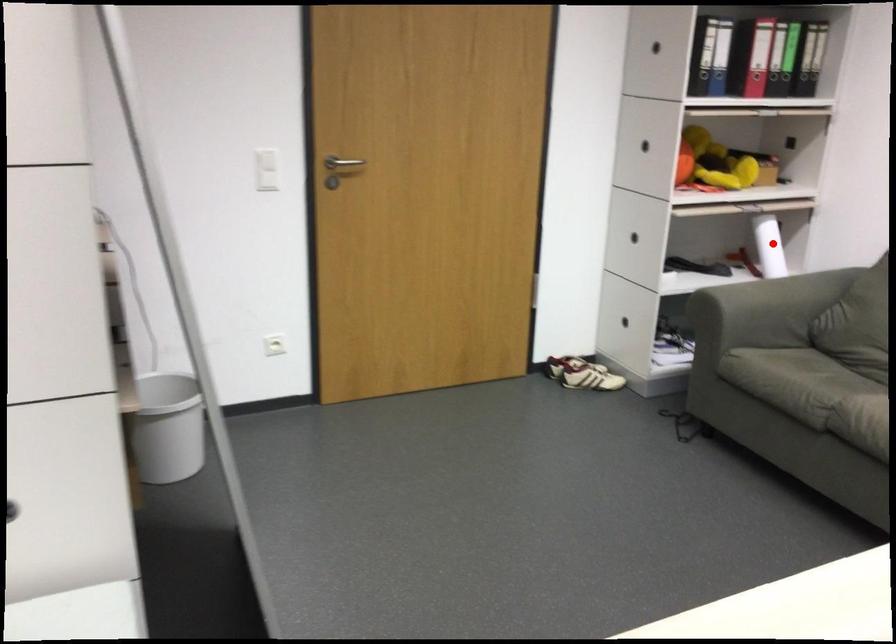
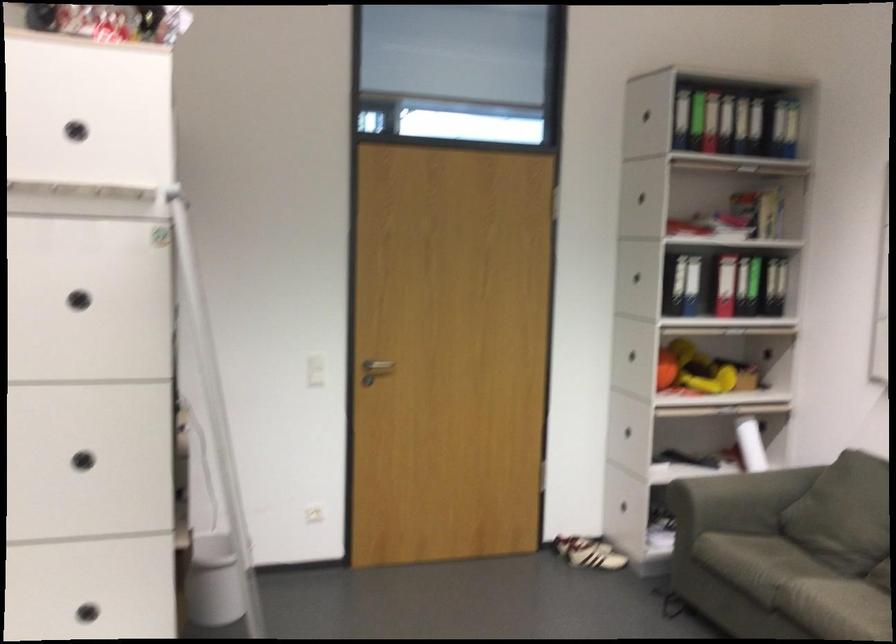
Question: I am providing you with two images of the same scene from different viewpoints. Image1 has a red point marked. In image2, the corresponding 3D location appears at what relative position? Reply with the corresponding letter.

Choices:
 (A) Closer
 (B) Farther

Answer: (B)